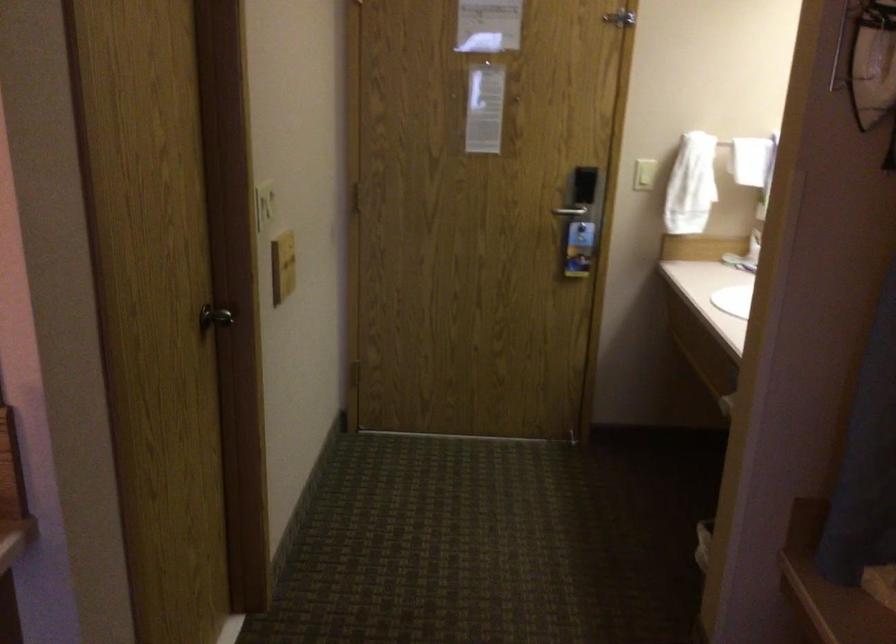
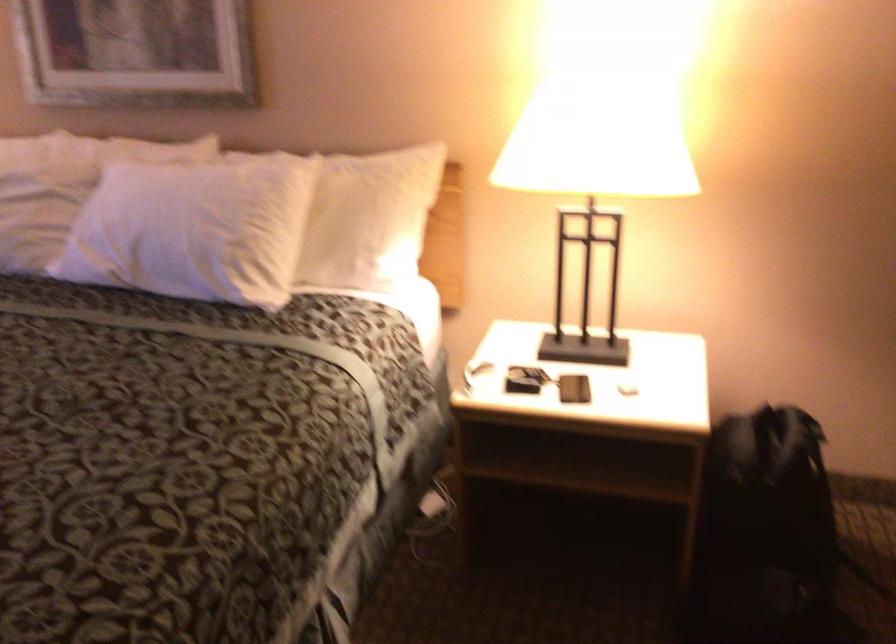
The images are taken continuously from a first-person perspective. In which direction is your viewpoint rotating?

The camera rotated toward left-down.